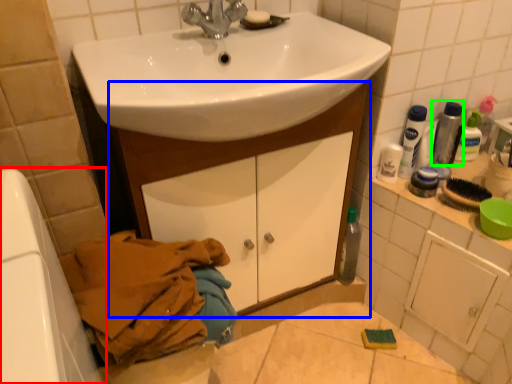
Question: Which object is positioned closest to bath (highlighted by a red box)? Select from bathroom cabinet (highlighted by a blue box) and mouthwash (highlighted by a green box).

Choices:
 (A) bathroom cabinet
 (B) mouthwash

Answer: (A)